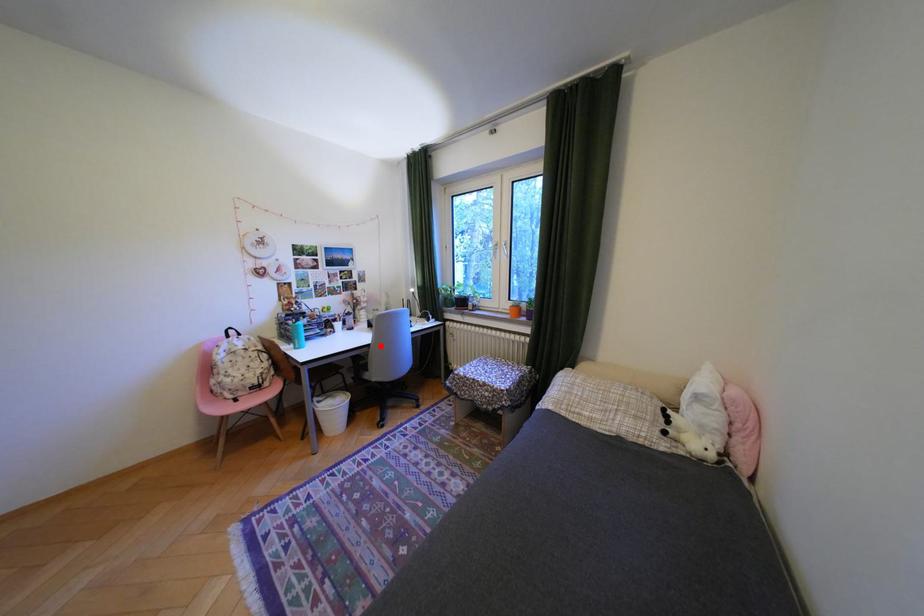
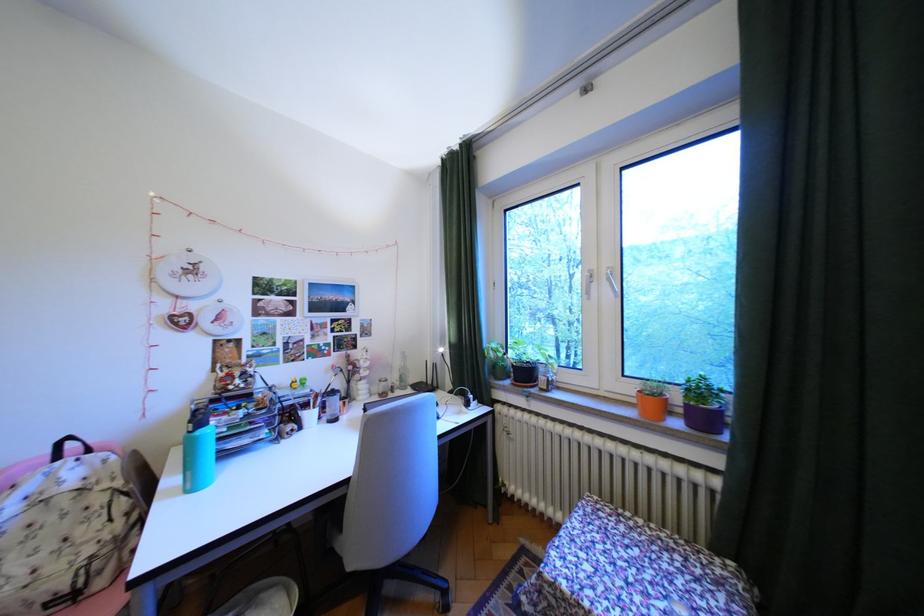
Find the pixel in the second image that matches the highlighted location in the first image.

(359, 483)